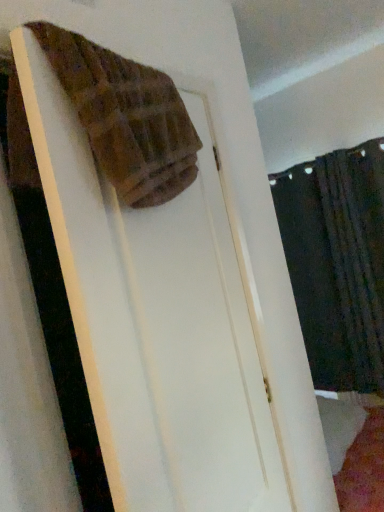
Question: Should I look upward or downward to see brown woven towel at upper left?

Choices:
 (A) up
 (B) down

Answer: (A)

Question: Does dark fabric curtain at right appear on the left side of brown woven towel at upper left?

Choices:
 (A) yes
 (B) no

Answer: (B)

Question: Is dark fabric curtain at right surrounding brown woven towel at upper left?

Choices:
 (A) no
 (B) yes

Answer: (A)

Question: Is dark fabric curtain at right aimed at brown woven towel at upper left?

Choices:
 (A) yes
 (B) no

Answer: (A)

Question: Is dark fabric curtain at right outside brown woven towel at upper left?

Choices:
 (A) yes
 (B) no

Answer: (A)

Question: Considering the relative sizes of dark fabric curtain at right and brown woven towel at upper left in the image provided, is dark fabric curtain at right thinner than brown woven towel at upper left?

Choices:
 (A) no
 (B) yes

Answer: (B)

Question: From a real-world perspective, is dark fabric curtain at right located higher than brown woven towel at upper left?

Choices:
 (A) no
 (B) yes

Answer: (A)

Question: Considering the relative sizes of brown woven towel at upper left and dark fabric curtain at right in the image provided, is brown woven towel at upper left taller than dark fabric curtain at right?

Choices:
 (A) no
 (B) yes

Answer: (A)

Question: From a real-world perspective, is brown woven towel at upper left beneath dark fabric curtain at right?

Choices:
 (A) yes
 (B) no

Answer: (B)

Question: Could you tell me if brown woven towel at upper left is turned towards dark fabric curtain at right?

Choices:
 (A) yes
 (B) no

Answer: (B)

Question: From the image's perspective, does brown woven towel at upper left appear higher than dark fabric curtain at right?

Choices:
 (A) no
 (B) yes

Answer: (B)

Question: Is dark fabric curtain at right located within brown woven towel at upper left?

Choices:
 (A) yes
 (B) no

Answer: (B)

Question: Can you confirm if brown woven towel at upper left is positioned to the right of dark fabric curtain at right?

Choices:
 (A) yes
 (B) no

Answer: (B)

Question: Is brown woven towel at upper left bigger or smaller than dark fabric curtain at right?

Choices:
 (A) small
 (B) big

Answer: (A)